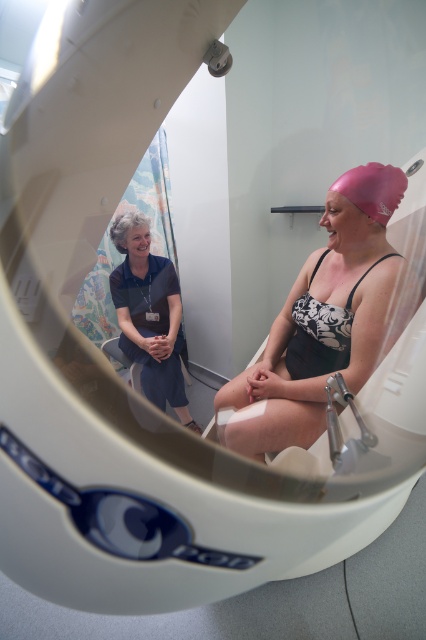
Question: Does blue fabric dress at upper left have a larger size compared to black printed bikini top at center?

Choices:
 (A) no
 (B) yes

Answer: (B)

Question: Which point is closer to the camera taking this photo?

Choices:
 (A) (344, 316)
 (B) (172, 266)

Answer: (A)

Question: Which point appears closest to the camera in this image?

Choices:
 (A) pos(293,339)
 (B) pos(181,420)

Answer: (A)

Question: In this image, where is pink matte swim cap at upper right located relative to blue fabric dress at upper left?

Choices:
 (A) right
 (B) left

Answer: (A)

Question: Can you confirm if pink matte swim cap at upper right is positioned below blue fabric dress at upper left?

Choices:
 (A) no
 (B) yes

Answer: (A)

Question: Which is nearer to the pink matte swim cap at upper right?

Choices:
 (A) black printed bikini top at center
 (B) blue fabric dress at upper left

Answer: (A)